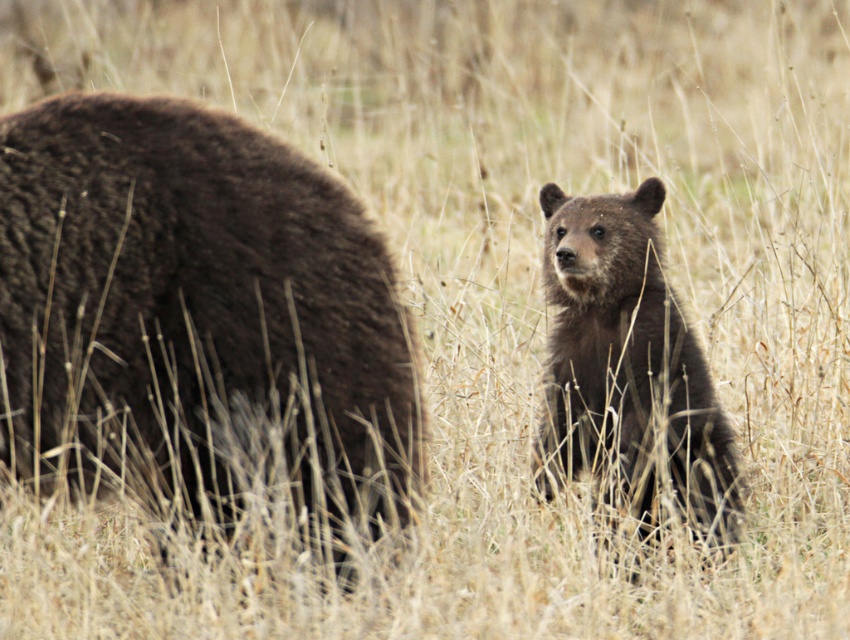
Where is the dark brown fur at left located in the image?

The dark brown fur at left is located at point (194, 310) in the image.